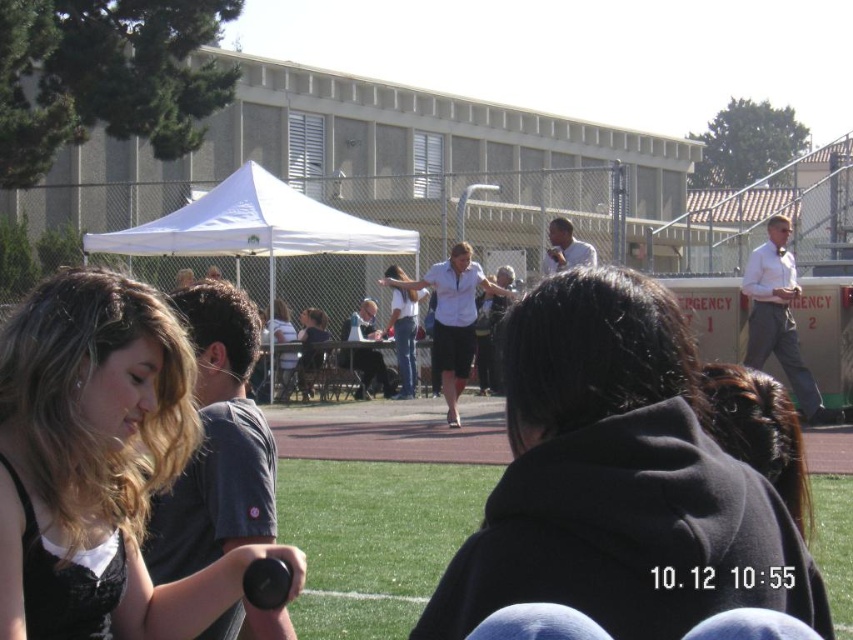
You are a photographer at the event and want to take a picture of the white fabric canopy at center and the matte white shirt at center. Which object should you zoom in on to ensure both are in focus?

The white fabric canopy at center is smaller than the matte white shirt at center, so you should zoom in on the matte white shirt at center to ensure both are in focus.

You are a photographer standing at the edge of the grassy field where the event is happening. You want to take a photo of the matte white shirt at center without the white fabric canopy at center blocking the view. Is this possible?

The white fabric canopy at center is above the matte white shirt at center, so it will block the view. You need to move to a different angle where the canopy is not directly overhead.

Looking at this image, you are standing at the edge of the field and want to walk towards the white fabric canopy at center. Which direction should you walk relative to the green grass at center?

To reach the white fabric canopy at center from the green grass at center, you should walk to the left since the green grass at center is located to the right of the white fabric canopy at center.